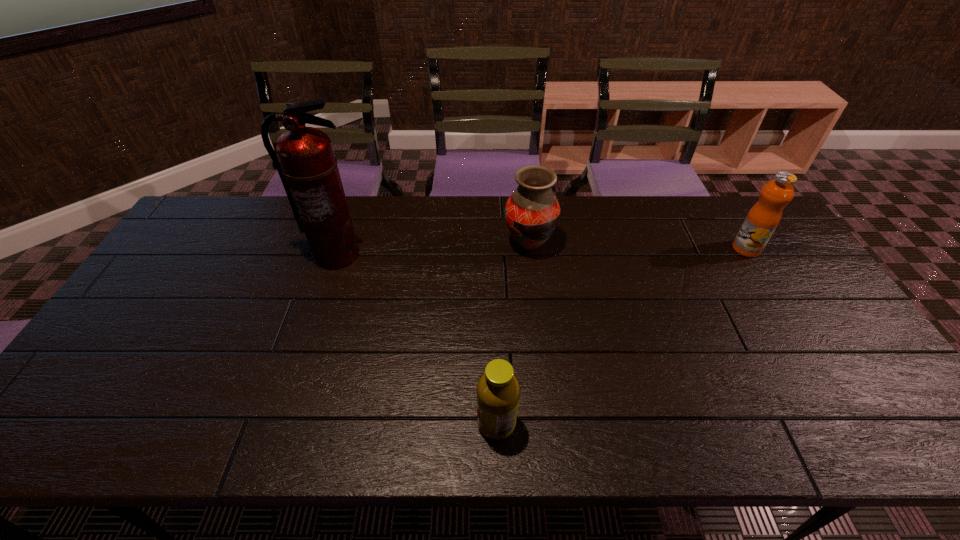
The width and height of the screenshot is (960, 540). What are the coordinates of `vacant space located 0.380m on the front label of the nearest object` in the screenshot? It's located at (308, 424).

Where is `vacant area located 0.350m on the front label of the nearest object`? vacant area located 0.350m on the front label of the nearest object is located at coordinates (321, 424).

Image resolution: width=960 pixels, height=540 pixels. What are the coordinates of `vacant region located on the front label of the nearest object` in the screenshot? It's located at (352, 424).

Image resolution: width=960 pixels, height=540 pixels. Find the location of `fire extinguisher located in the far edge section of the desktop`. fire extinguisher located in the far edge section of the desktop is located at coordinates (304, 157).

Find the location of a particular element. fruit juice that is at the far edge is located at coordinates (761, 221).

Where is `vase that is at the far edge`? vase that is at the far edge is located at coordinates (532, 212).

Image resolution: width=960 pixels, height=540 pixels. I want to click on object located in the near edge section of the desktop, so click(498, 391).

The height and width of the screenshot is (540, 960). Find the location of `object that is at the right edge`. object that is at the right edge is located at coordinates (761, 221).

This screenshot has height=540, width=960. What are the coordinates of `object present at the far right corner` in the screenshot? It's located at (761, 221).

Locate an element on the screen. Image resolution: width=960 pixels, height=540 pixels. free region at the far edge is located at coordinates (625, 232).